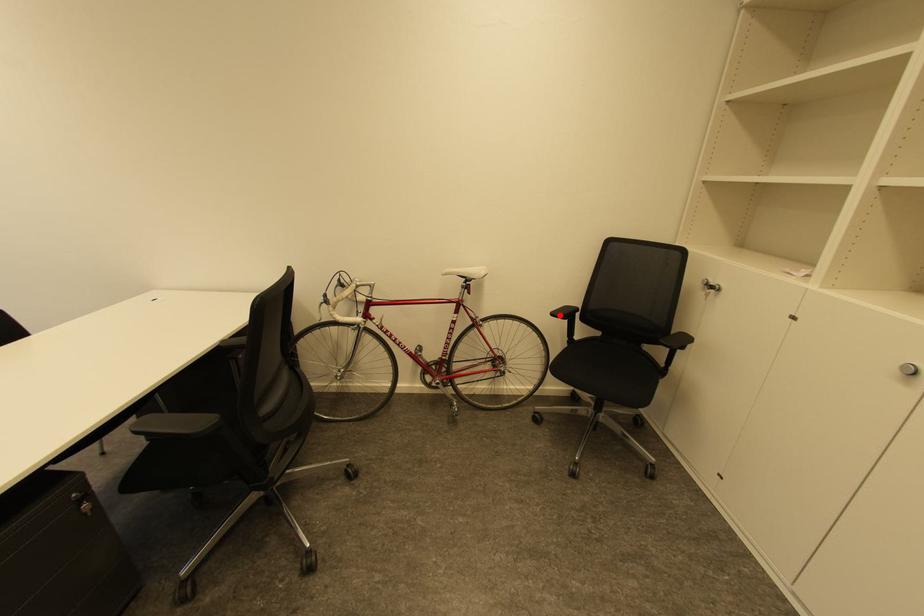
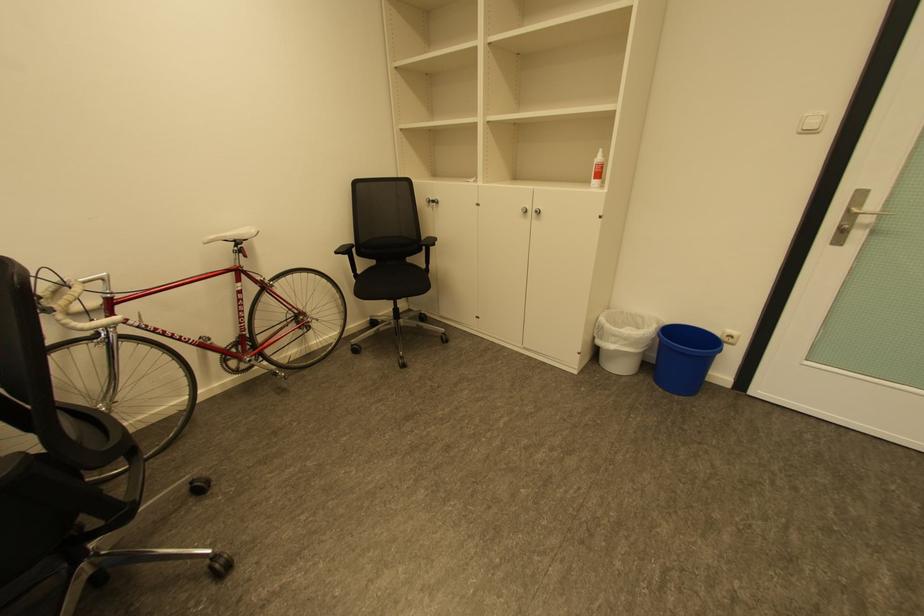
Question: I am providing you with two images of the same scene from different viewpoints. A red point is shown in image1. For the corresponding object point in image2, is it positioned nearer or farther from the camera?

Choices:
 (A) Nearer
 (B) Farther

Answer: (A)